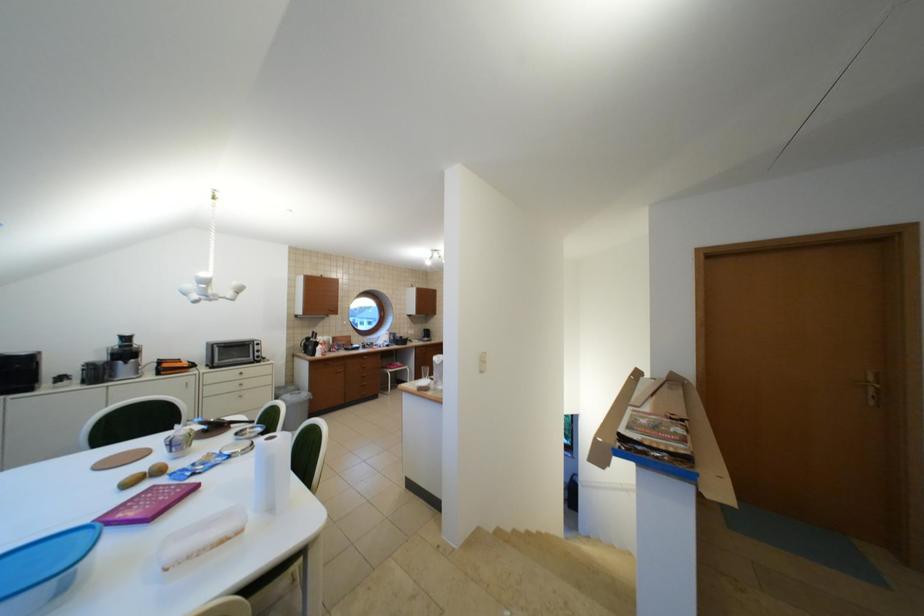
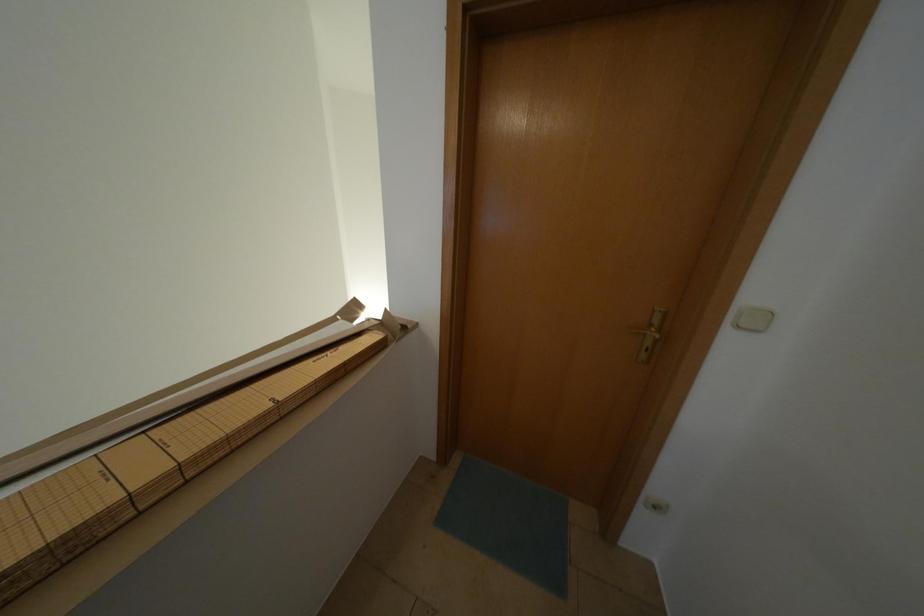
Which direction would the cameraman need to move to produce the second image?

The cameraman moved toward right, forward.